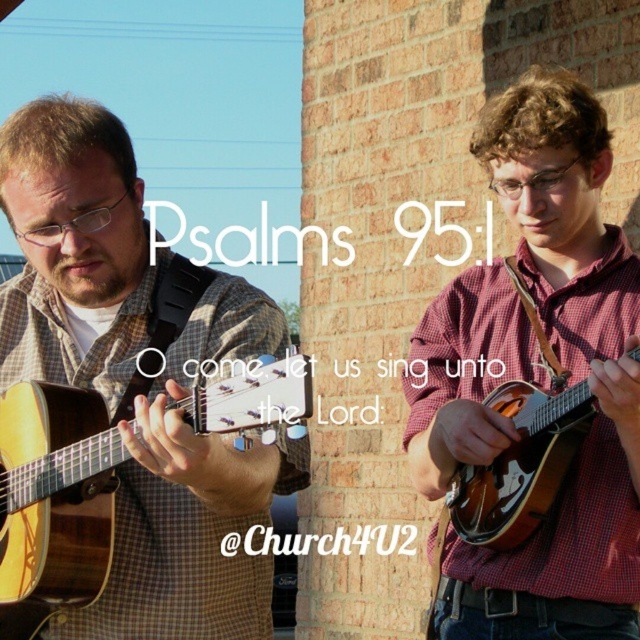
Who is positioned more to the left, matte brown mandolin at right or acoustic wood guitar at left?

From the viewer's perspective, acoustic wood guitar at left appears more on the left side.

Which is more to the right, matte brown mandolin at right or acoustic wood guitar at left?

matte brown mandolin at right

Locate an element on the screen. The image size is (640, 640). matte brown mandolin at right is located at coordinates (538, 376).

Between point (307, 410) and point (538, 486), which one is positioned behind?

The point (538, 486) is more distant.

Between acoustic wood guitar at left and wooden mandolin at right, which one appears on the left side from the viewer's perspective?

acoustic wood guitar at left

What are the coordinates of `acoustic wood guitar at left` in the screenshot? It's located at (52, 500).

Between point (600, 282) and point (589, 408), which one is positioned behind?

Point (600, 282)

Who is taller, matte brown mandolin at right or wooden mandolin at right?

Standing taller between the two is wooden mandolin at right.

Locate an element on the screen. The width and height of the screenshot is (640, 640). matte brown mandolin at right is located at coordinates (538, 376).